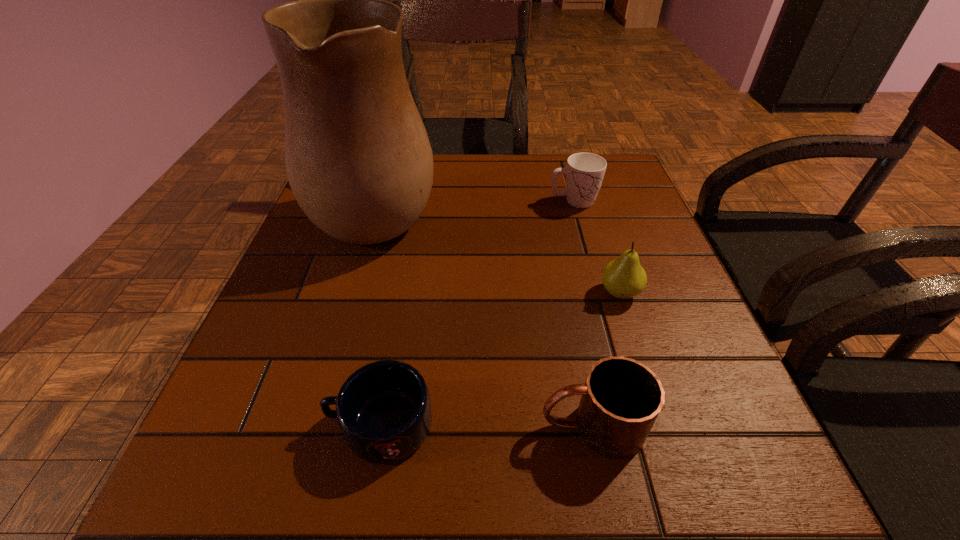
You are a GUI agent. You are given a task and a screenshot of the screen. Output one action in this format:
    pyautogui.click(x=<x>, y=<y>)
    Task: Click on the mug that is the second closest one to the tallest object
    This screenshot has width=960, height=540.
    Given the screenshot: What is the action you would take?
    pyautogui.click(x=383, y=409)

Point out which mug is positioned as the second nearest to the pear. Please provide its 2D coordinates. Your answer should be formatted as a tuple, i.e. [(x, y)], where the tuple contains the x and y coordinates of a point satisfying the conditions above.

[(584, 172)]

Find the location of `free space that satisfies the following two spatial constraints: 1. on the side of the farthest mug with the handle; 2. on the back side of the pear`. free space that satisfies the following two spatial constraints: 1. on the side of the farthest mug with the handle; 2. on the back side of the pear is located at coordinates (599, 293).

Locate an element on the screen. The height and width of the screenshot is (540, 960). vacant space that satisfies the following two spatial constraints: 1. on the back side of the pear; 2. at the spout of the tallest object is located at coordinates (592, 209).

Where is `vacant position in the image that satisfies the following two spatial constraints: 1. on the side of the farthest mug with the handle; 2. on the right side of the pear`? vacant position in the image that satisfies the following two spatial constraints: 1. on the side of the farthest mug with the handle; 2. on the right side of the pear is located at coordinates (599, 293).